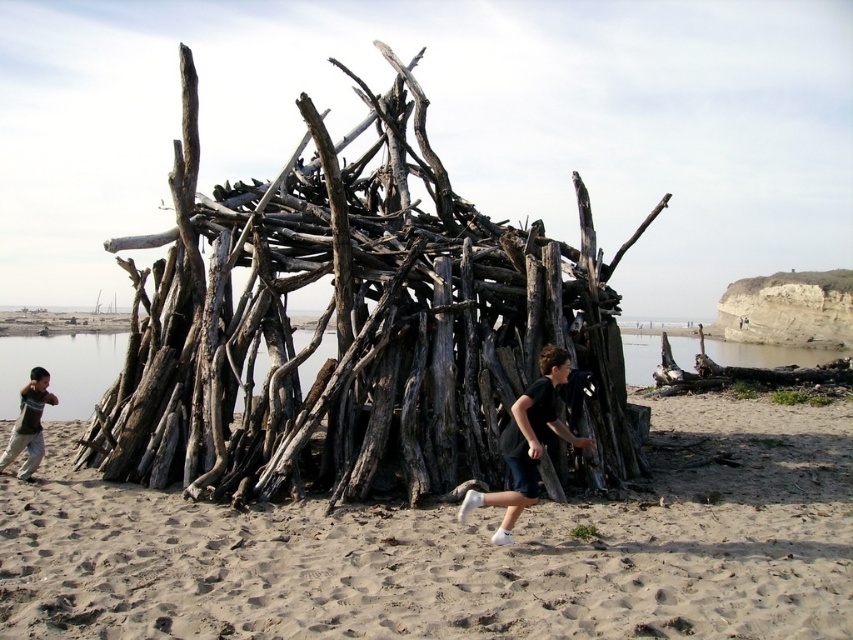
You are standing on the beach looking at the scene. Which object is nearer to you, the light beige sand at lower center or the dark gray cotton shirt at lower left?

The light beige sand at lower center is closer to the viewer than the dark gray cotton shirt at lower left.

You are standing at the edge of the beach facing the water. You want to place a new sandcastle exactly 0.5 meters to the left of the drab wood structure at center. Where should you place it?

Since the drab wood structure at center is located at coordinates (358, 326), placing the sandcastle 0.5 meters to the left would position it at coordinates (358, 6).